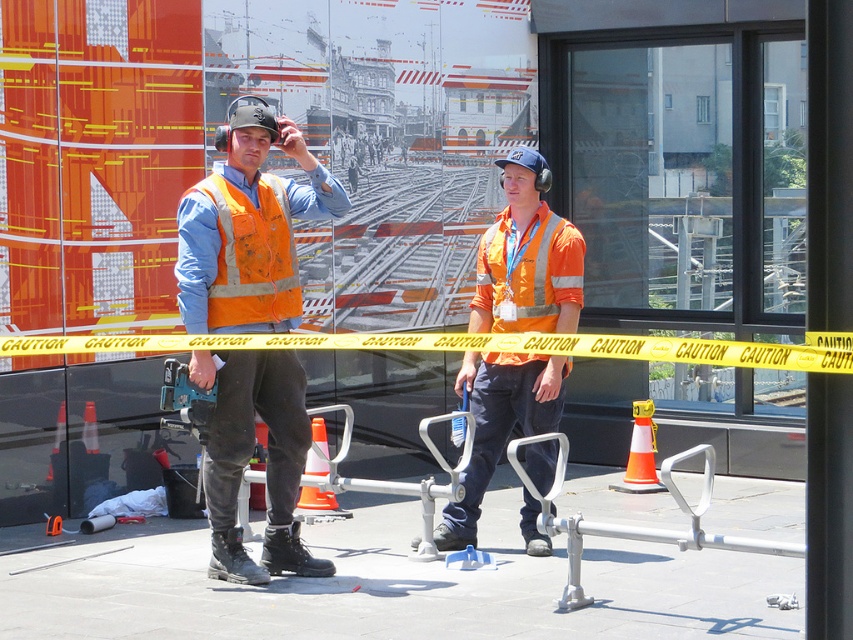
Does matte orange safety vest at center have a lesser height compared to reflective orange safety vest at left?

In fact, matte orange safety vest at center may be taller than reflective orange safety vest at left.

Is point (265, 568) positioned in front of point (230, 202)?

No.

The width and height of the screenshot is (853, 640). Identify the location of matte orange safety vest at center. (248, 228).

Between metallic train track at center and reflective orange safety vest at left, which one appears on the right side from the viewer's perspective?

From the viewer's perspective, metallic train track at center appears more on the right side.

Can you confirm if metallic train track at center is shorter than reflective orange safety vest at left?

No, metallic train track at center is not shorter than reflective orange safety vest at left.

Locate an element on the screen. The width and height of the screenshot is (853, 640). metallic train track at center is located at coordinates (399, 246).

Who is taller, matte orange safety vest at center or orange reflective vest at center?

matte orange safety vest at center

Which is below, matte orange safety vest at center or orange reflective vest at center?

Positioned lower is orange reflective vest at center.

Is point (280, 316) positioned behind point (486, 440)?

No, (280, 316) is in front of (486, 440).

Find the location of `matte orange safety vest at center`. matte orange safety vest at center is located at coordinates (248, 228).